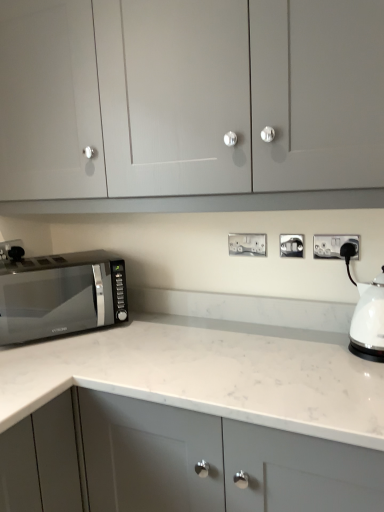
Question: Relative to silver metallic socket at center, the 2th electric outlet when ordered from back to front, is white marble countertop at center in front or behind?

Choices:
 (A) behind
 (B) front

Answer: (B)

Question: Based on their positions, is white marble countertop at center located to the left or right of silver metallic socket at center, positioned as the 3th electric outlet in right-to-left order?

Choices:
 (A) right
 (B) left

Answer: (B)

Question: Estimate the real-world distances between objects in this image. Which object is closer to the satin black microwave at lower left?

Choices:
 (A) satin silver socket at center, the 3th electric outlet from the back
 (B) white glossy kettle at right
 (C) silver metallic socket at center, positioned as the 3th electric outlet in right-to-left order
 (D) white plastic electric outlet at center right, which is the 1th electric outlet in right-to-left order
 (E) white marble countertop at center

Answer: (E)

Question: Estimate the real-world distances between objects in this image. Which object is closer to the satin black microwave at lower left?

Choices:
 (A) white glossy kettle at right
 (B) white marble countertop at center
 (C) satin silver socket at lower left, which is counted as the fourth electric outlet, starting from the front
 (D) satin silver socket at center, the 2th electric outlet from the front
 (E) matte gray cabinet at upper center

Answer: (C)